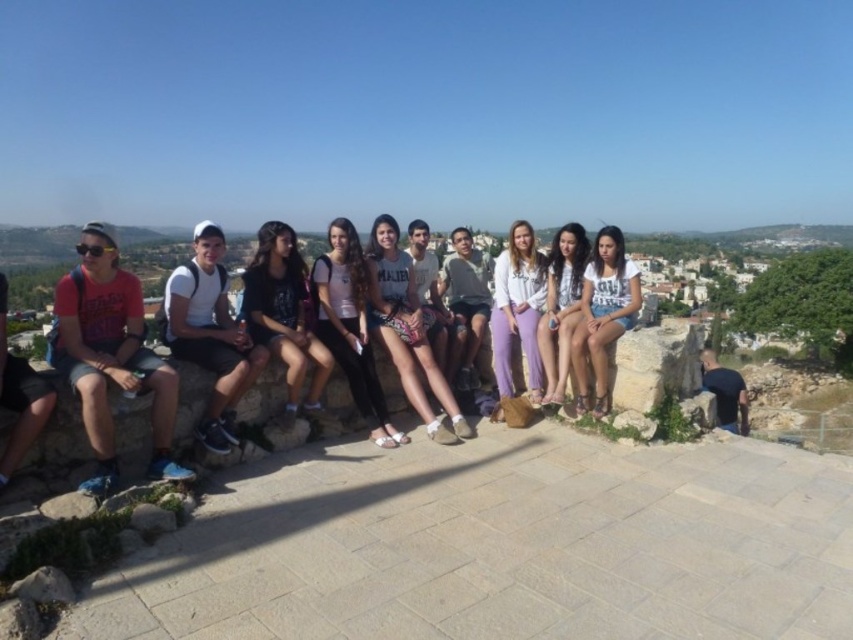
You are standing in front of the group of ten people sitting on the stone ledge. You want to take a photo that includes both the point at location (166, 458) and the point at (265, 358). Which point should you focus on first to ensure both are in sharp focus?

You should focus on point (265, 358) first because it is farther from the camera than point (166, 458). By focusing on the farther point, the closer point will also be within the depth of field, ensuring both are in sharp focus.